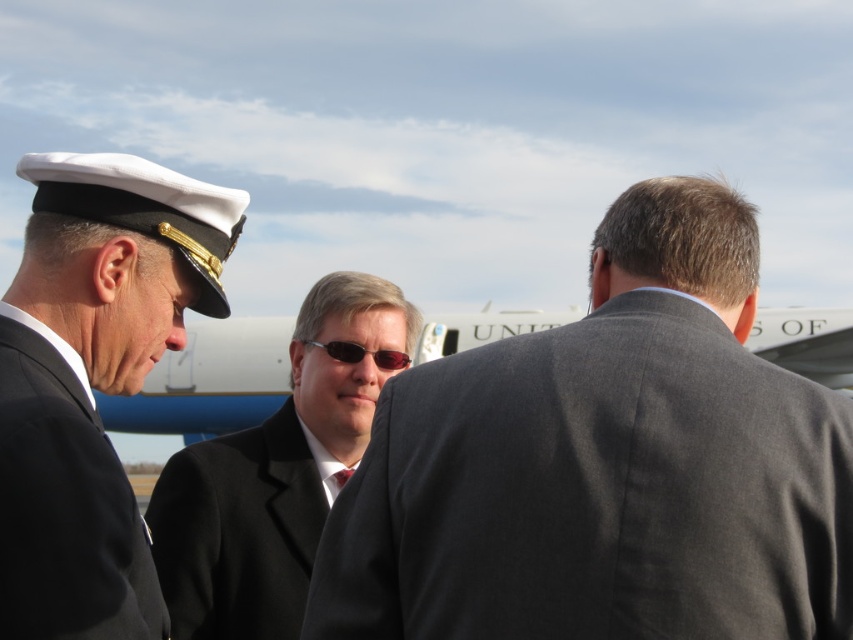
Question: Which object is closer to the camera taking this photo?

Choices:
 (A) white matte cap at left
 (B) black matte suit at left
 (C) black suit at center

Answer: (B)

Question: Can you confirm if black matte suit at left is positioned to the right of sunglasses at center?

Choices:
 (A) yes
 (B) no

Answer: (B)

Question: Can you confirm if dark gray suit at center is positioned above sunglasses at center?

Choices:
 (A) yes
 (B) no

Answer: (B)

Question: Which point is farther to the camera?

Choices:
 (A) (3, 401)
 (B) (350, 356)

Answer: (B)

Question: Does dark gray suit at center have a larger size compared to black suit at center?

Choices:
 (A) yes
 (B) no

Answer: (B)

Question: Which point is closer to the camera?

Choices:
 (A) white matte cap at left
 (B) black suit at center
 (C) sunglasses at center
 (D) black matte suit at left

Answer: (D)